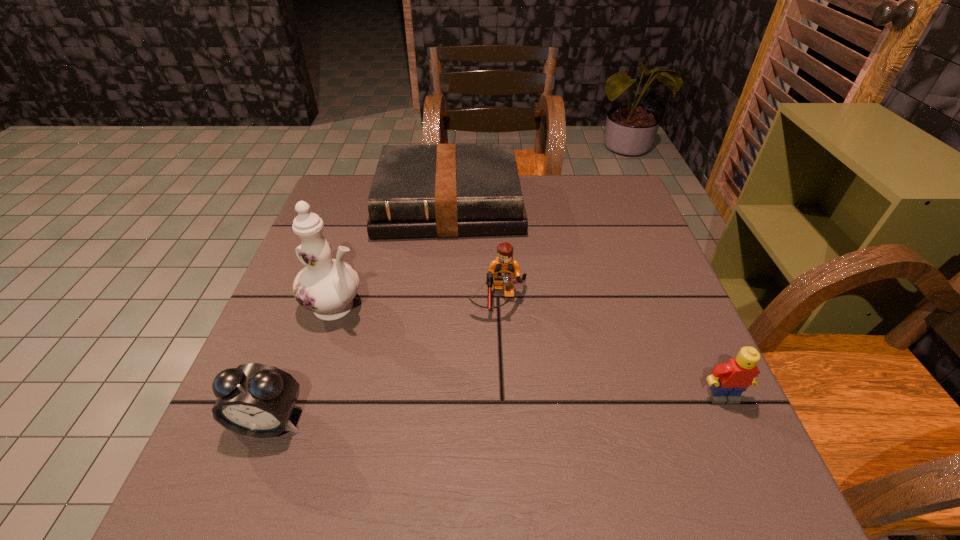
Identify the location of vacant region located 0.190m on the spine side of the farthest object. [x=449, y=294].

Identify the location of free space located holding a crossbow in the hands of the farther Lego. (499, 372).

Identify the location of free space located 0.140m holding a crossbow in the hands of the farther Lego. The height and width of the screenshot is (540, 960). (499, 376).

This screenshot has height=540, width=960. Find the location of `free space located 0.210m holding a crossbow in the hands of the farther Lego`. free space located 0.210m holding a crossbow in the hands of the farther Lego is located at coordinates (499, 408).

Locate an element on the screen. The width and height of the screenshot is (960, 540). free region located at the spout of the chinaware is located at coordinates (507, 400).

Locate an element on the screen. free point located 0.370m at the spout of the chinaware is located at coordinates (512, 402).

The image size is (960, 540). I want to click on vacant space located at the spout of the chinaware, so click(x=445, y=365).

I want to click on object at the far edge, so click(x=446, y=190).

Find the location of a particular element. This screenshot has width=960, height=540. alarm clock present at the near edge is located at coordinates (256, 400).

Where is `Lego that is positioned at the near edge`? The image size is (960, 540). Lego that is positioned at the near edge is located at coordinates (728, 381).